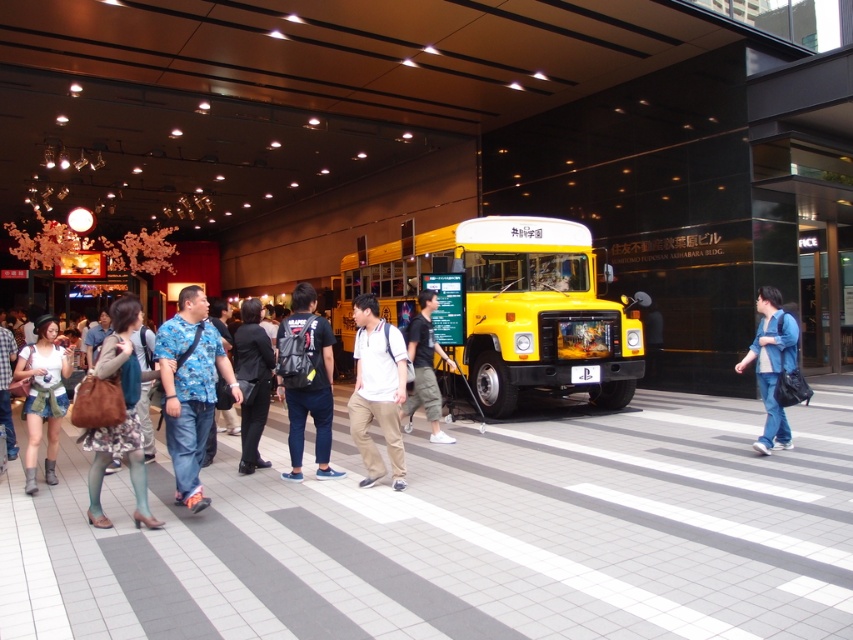
You are a delivery robot with a 1.5 meter wide package. You need to navigate between the blue denim jeans at center and the black fabric pants at center. Can you fit through the space between them without moving either object?

The distance between the blue denim jeans at center and the black fabric pants at center is 5.81 meters. Since your package is only 1.5 meters wide, there is sufficient space to navigate through the gap without moving either object.

You are standing at the entrance of the mall and see a black matte backpack at center and a white matte shirt at center. Which object is closer to you?

The black matte backpack at center is closer to you because it is further to the viewer than the white matte shirt at center.